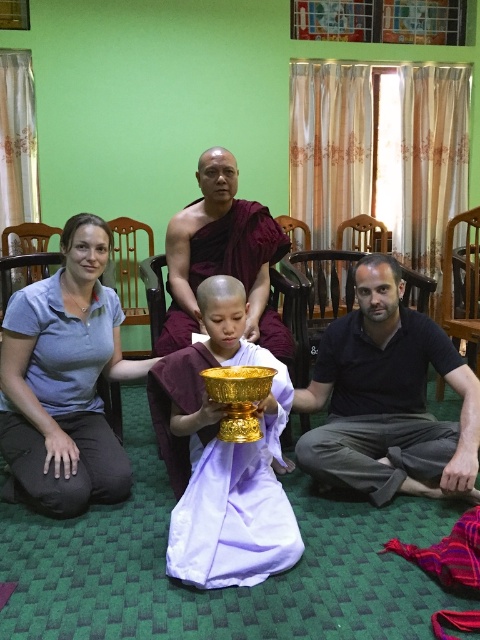
Question: Can you confirm if blue cotton shirt at lower left is positioned below matte gold bowl at center?

Choices:
 (A) yes
 (B) no

Answer: (A)

Question: Is blue cotton shirt at lower left positioned in front of maroon cloth monk at center?

Choices:
 (A) no
 (B) yes

Answer: (B)

Question: Which point appears farthest from the camera in this image?

Choices:
 (A) (428, 445)
 (B) (274, 328)
 (C) (111, 380)

Answer: (B)

Question: Which of these objects is positioned closest to the gold shiny bowl at center?

Choices:
 (A) dark blue shirt at center
 (B) blue cotton shirt at lower left
 (C) maroon cloth monk at center

Answer: (B)

Question: Based on their relative distances, which object is nearer to the blue cotton shirt at lower left?

Choices:
 (A) dark blue shirt at center
 (B) maroon cloth monk at center
 (C) gold shiny bowl at center
 (D) matte gold bowl at center

Answer: (D)

Question: Does blue cotton shirt at lower left appear under gold shiny bowl at center?

Choices:
 (A) yes
 (B) no

Answer: (B)